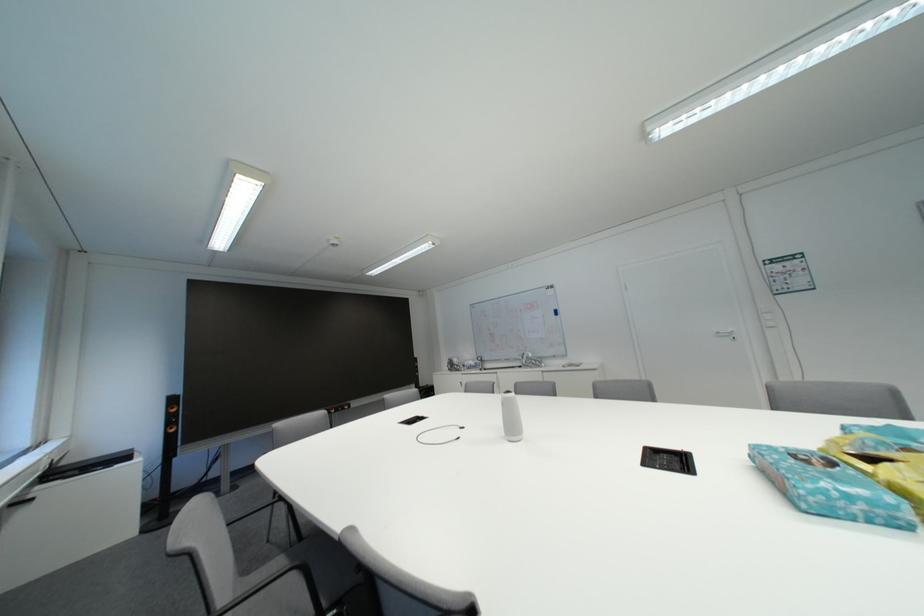
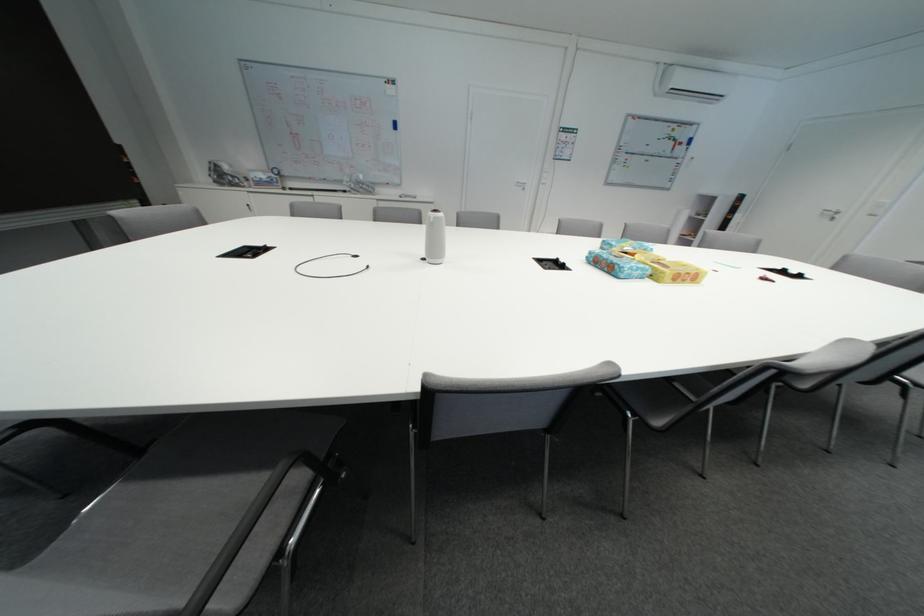
The point at [655,451] is marked in the first image. Where is the corresponding point in the second image?

(544, 262)